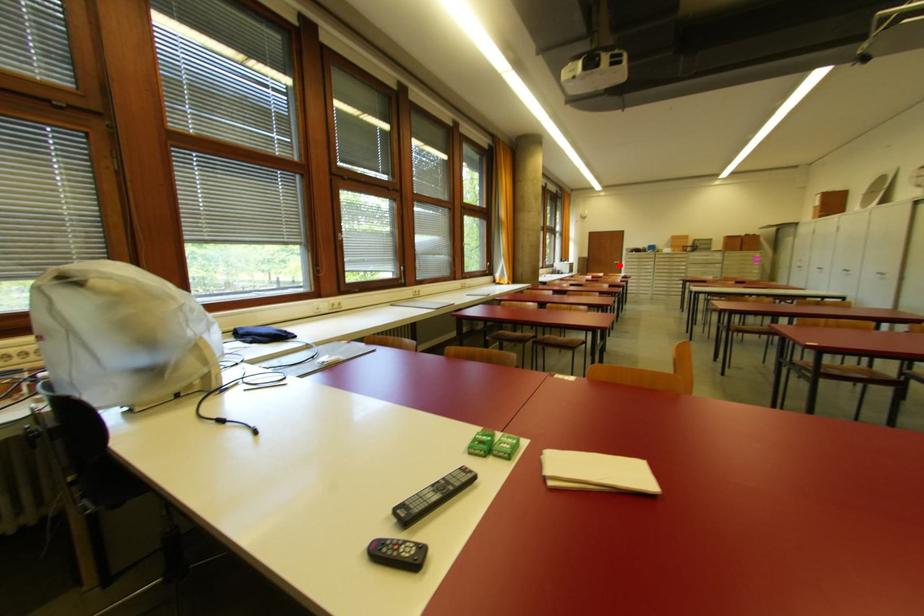
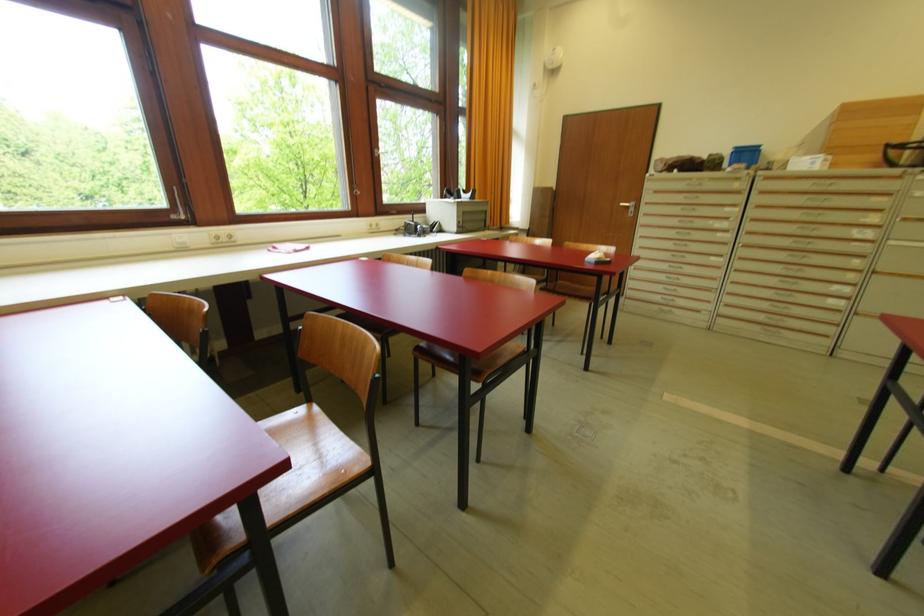
Locate, in the second image, the point that corresponds to the highlighted location in the first image.

(629, 209)